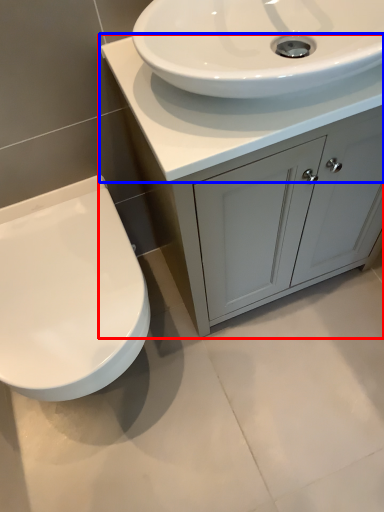
Question: Which point is further to the camera, bathroom cabinet (highlighted by a red box) or counter top (highlighted by a blue box)?

Choices:
 (A) bathroom cabinet
 (B) counter top

Answer: (A)